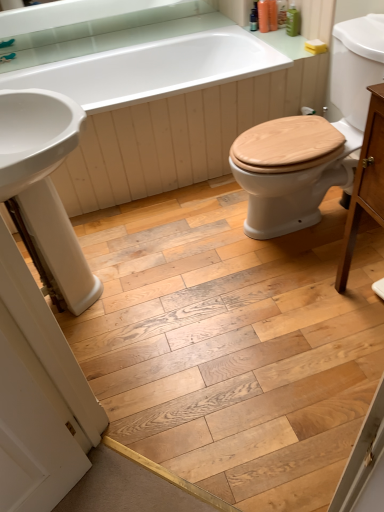
Question: Should I look upward or downward to see brushed metal faucet at upper left?

Choices:
 (A) up
 (B) down

Answer: (A)

Question: Is brushed metal faucet at upper left oriented towards white glossy sink at left?

Choices:
 (A) yes
 (B) no

Answer: (B)

Question: Can you confirm if brushed metal faucet at upper left is positioned to the left of white glossy sink at left?

Choices:
 (A) no
 (B) yes

Answer: (B)

Question: Is brushed metal faucet at upper left taller than white glossy sink at left?

Choices:
 (A) no
 (B) yes

Answer: (A)

Question: Is brushed metal faucet at upper left in front of white glossy sink at left?

Choices:
 (A) no
 (B) yes

Answer: (A)

Question: Considering the relative sizes of brushed metal faucet at upper left and white glossy sink at left in the image provided, is brushed metal faucet at upper left shorter than white glossy sink at left?

Choices:
 (A) yes
 (B) no

Answer: (A)

Question: Can you confirm if brushed metal faucet at upper left is smaller than white glossy sink at left?

Choices:
 (A) no
 (B) yes

Answer: (B)

Question: Can you confirm if brushed metal faucet at upper left is shorter than white glossy bathtub at upper center?

Choices:
 (A) no
 (B) yes

Answer: (B)

Question: Considering the relative sizes of brushed metal faucet at upper left and white glossy bathtub at upper center in the image provided, is brushed metal faucet at upper left bigger than white glossy bathtub at upper center?

Choices:
 (A) yes
 (B) no

Answer: (B)

Question: Is brushed metal faucet at upper left outside white glossy bathtub at upper center?

Choices:
 (A) no
 (B) yes

Answer: (B)

Question: Considering the relative positions of brushed metal faucet at upper left and white glossy bathtub at upper center in the image provided, is brushed metal faucet at upper left to the right of white glossy bathtub at upper center from the viewer's perspective?

Choices:
 (A) yes
 (B) no

Answer: (B)

Question: Does brushed metal faucet at upper left lie in front of white glossy bathtub at upper center?

Choices:
 (A) yes
 (B) no

Answer: (B)

Question: Can you confirm if brushed metal faucet at upper left is positioned to the left of white glossy bathtub at upper center?

Choices:
 (A) no
 (B) yes

Answer: (B)

Question: Is white glossy bathtub at upper center bigger than brushed metal faucet at upper left?

Choices:
 (A) yes
 (B) no

Answer: (A)